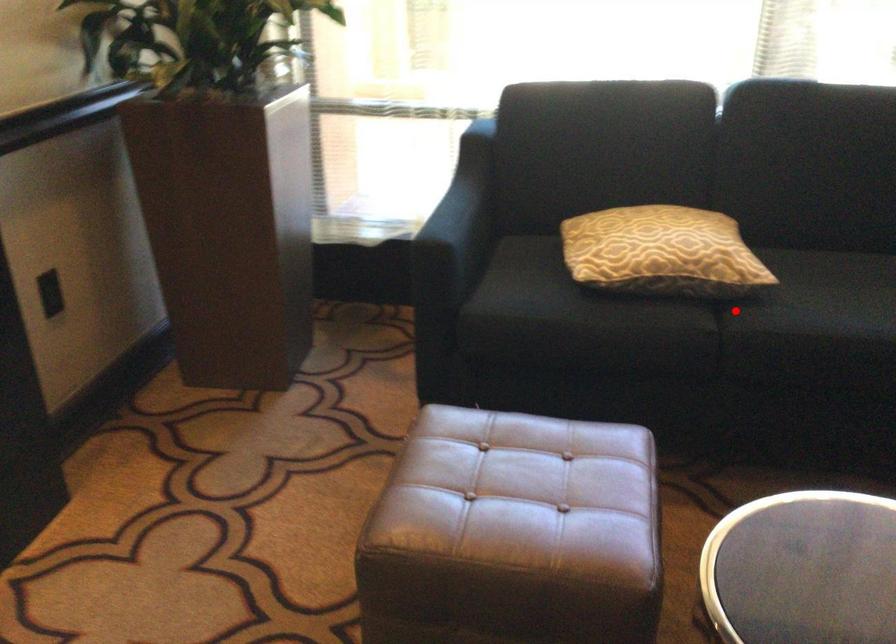
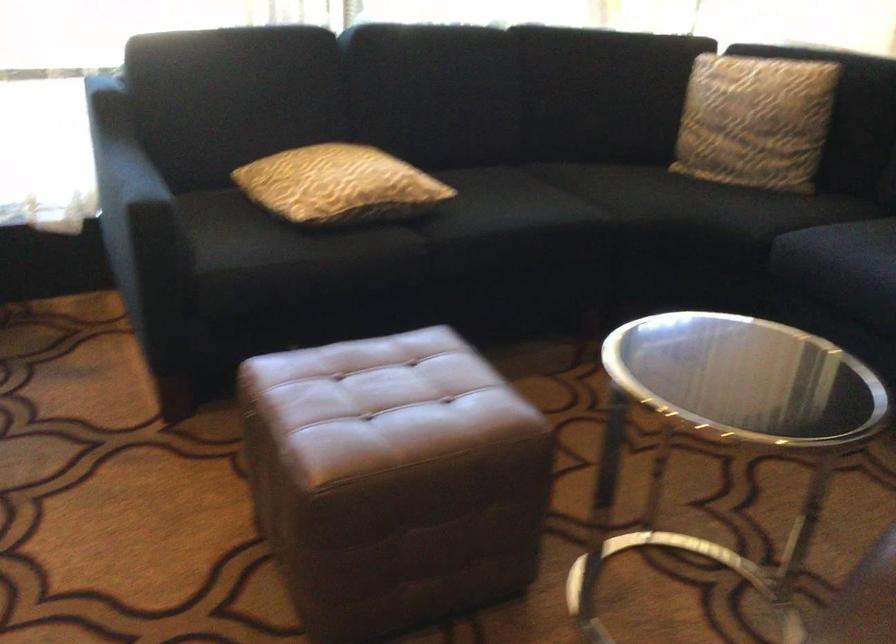
Question: I am providing you with two images of the same scene from different viewpoints. In image1, a red point is highlighted. Considering the same 3D point in image2, which of the following is correct?

Choices:
 (A) It is closer
 (B) It is farther

Answer: (B)